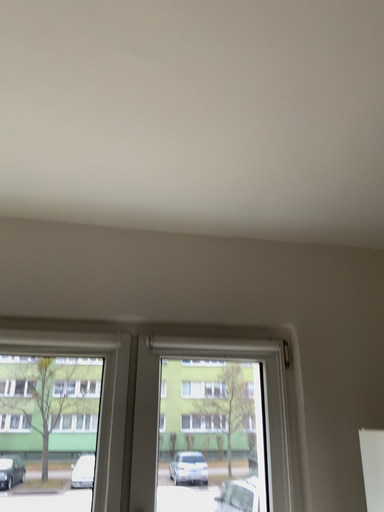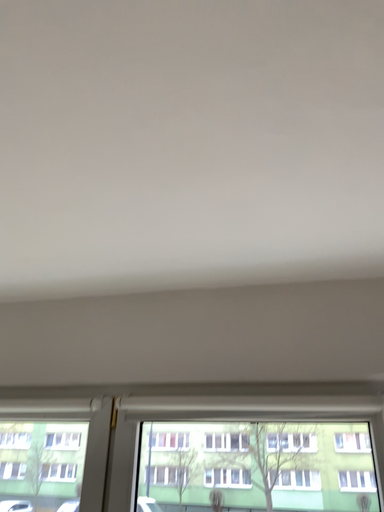
Question: How did the camera likely rotate when shooting the video?

Choices:
 (A) rotated left
 (B) rotated right

Answer: (A)